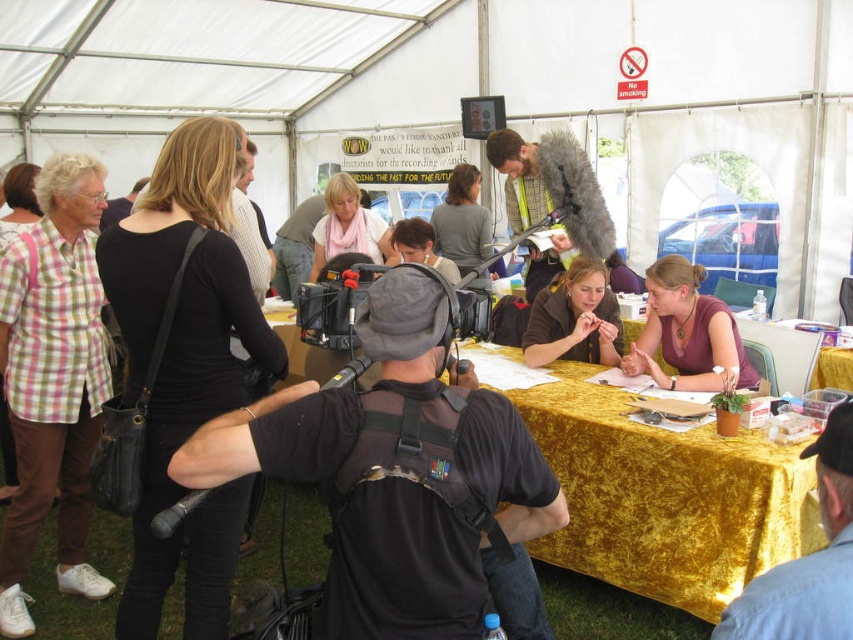
You are organizing a media event and need to place a large item and a small item on a table. You have the black leather bag at upper left and the purple fabric at center. Which object should you choose to place on the table if you need an item that takes up more space?

The black leather bag at upper left has a larger size compared to the purple fabric at center, so you should choose the black leather bag at upper left to place on the table as it takes up more space.

You are organizing a small event and need to place a matte brown jacket at center on a gold velvet table at center. Can you fit the jacket on the table?

The gold velvet table at center is wider than the matte brown jacket at center, so yes, the matte brown jacket at center can fit on the gold velvet table at center.

You are a photographer positioned at the back of the tent. You need to capture a clear photo of both the plaid shirt at left and the purple fabric at center. Which object will appear larger in your photo?

The plaid shirt at left will appear larger in the photo because it is closer to the viewer than the purple fabric at center.